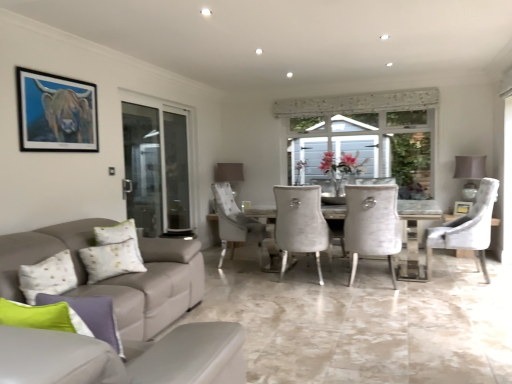
Question: Is white textured pillow at lower left, placed as the 1th pillow when sorted from back to front, positioned with its back to white fabric lampshade at right, which is the 2th lamp from left to right?

Choices:
 (A) yes
 (B) no

Answer: (B)

Question: Is white textured pillow at lower left, which is the 2th pillow in right-to-left order, in contact with white fabric lampshade at right, which is the 2th lamp from left to right?

Choices:
 (A) yes
 (B) no

Answer: (B)

Question: From a real-world perspective, is white textured pillow at lower left, which is the 2th pillow in right-to-left order, on white fabric lampshade at right, the first lamp viewed from the front?

Choices:
 (A) yes
 (B) no

Answer: (B)

Question: Is white textured pillow at lower left, placed as the 1th pillow when sorted from back to front, shorter than white fabric lampshade at right, arranged as the second lamp when viewed from the back?

Choices:
 (A) no
 (B) yes

Answer: (B)

Question: Is white textured pillow at lower left, which is counted as the first pillow, starting from the left, wider than white fabric lampshade at right, the first lamp viewed from the front?

Choices:
 (A) yes
 (B) no

Answer: (B)

Question: Is white textured pillow at lower left, placed as the 1th pillow when sorted from back to front, positioned far away from white fabric lampshade at right, which is the 2th lamp from left to right?

Choices:
 (A) no
 (B) yes

Answer: (B)

Question: Does matte gray lampshade at upper center, the first lamp from the back, have a larger size compared to transparent glass screen door at left?

Choices:
 (A) yes
 (B) no

Answer: (B)

Question: Is matte gray lampshade at upper center, the first lamp positioned from the left, shorter than transparent glass screen door at left?

Choices:
 (A) yes
 (B) no

Answer: (A)

Question: Is matte gray lampshade at upper center, the first lamp positioned from the left, wider than transparent glass screen door at left?

Choices:
 (A) no
 (B) yes

Answer: (B)

Question: From the image's perspective, is matte gray lampshade at upper center, the first lamp positioned from the left, over transparent glass screen door at left?

Choices:
 (A) yes
 (B) no

Answer: (B)

Question: From the image's perspective, is matte gray lampshade at upper center, the first lamp from the back, located beneath transparent glass screen door at left?

Choices:
 (A) yes
 (B) no

Answer: (A)

Question: Is the position of matte gray lampshade at upper center, which appears as the 2th lamp when viewed from the front, more distant than that of transparent glass screen door at left?

Choices:
 (A) no
 (B) yes

Answer: (B)

Question: Is white textured chair at center, which is the 2th chair from right to left, outside light gray fabric couch at lower left?

Choices:
 (A) no
 (B) yes

Answer: (B)